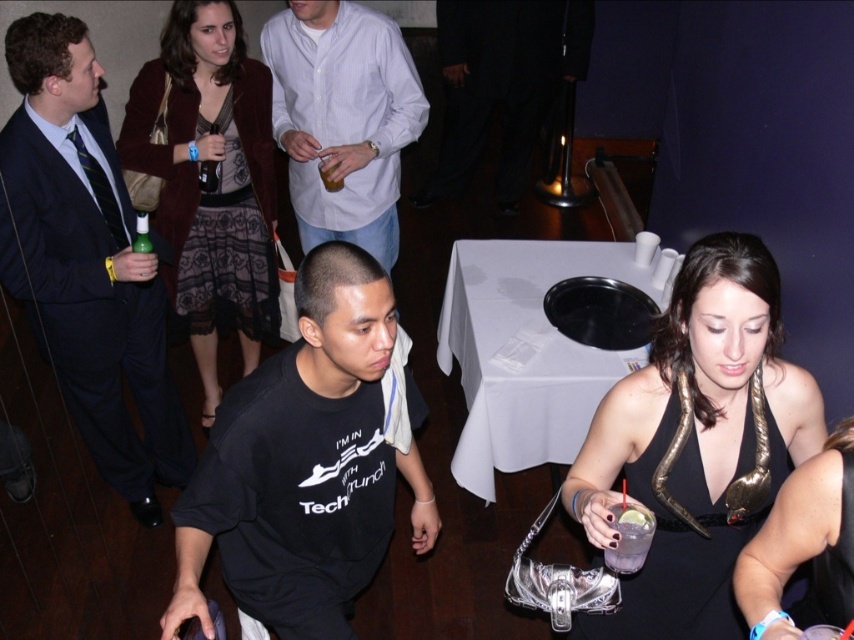
You are at a party and see the black satin dress at lower right and the clear plastic cup at center. Which object is closer to you?

The black satin dress at lower right is closer to you because it is in front of the clear plastic cup at center.

You are at a party and need to grab a drink from the clear plastic cup at center without touching the black satin dress at lower right. Is this possible?

The black satin dress at lower right is positioned on the right side of the clear plastic cup at center, so there is space to the left of the cup to reach it without touching the dress.